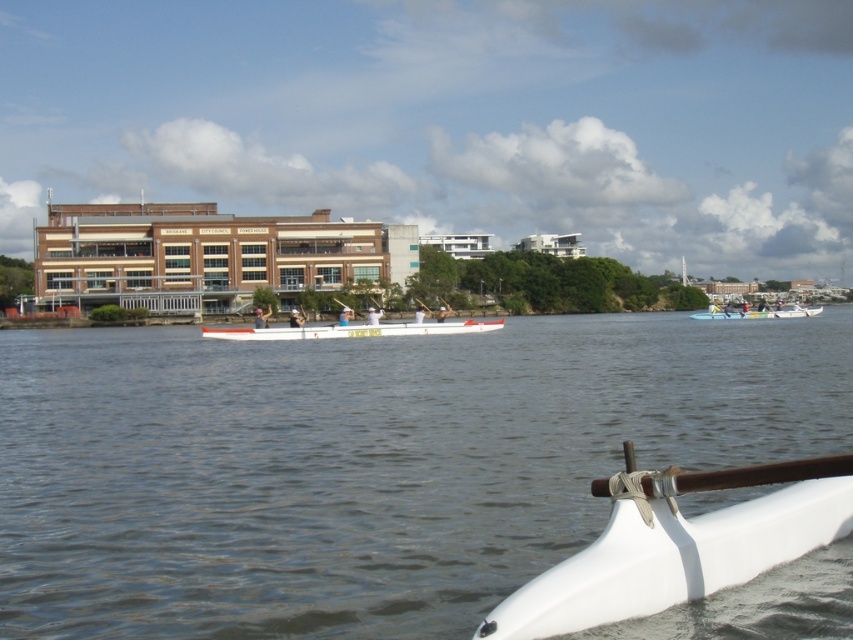
Question: Does white matte boat at lower right lie behind white glossy canoe at center?

Choices:
 (A) no
 (B) yes

Answer: (A)

Question: Does white matte boat at lower right have a lesser width compared to white wood boat at center?

Choices:
 (A) yes
 (B) no

Answer: (A)

Question: Which point appears farthest from the camera in this image?

Choices:
 (A) (753, 308)
 (B) (86, 433)
 (C) (202, 337)

Answer: (A)

Question: Is white matte boat at lower right wider than white wood boat at center?

Choices:
 (A) no
 (B) yes

Answer: (A)

Question: Estimate the real-world distances between objects in this image. Which object is farther from the white wood boat at center?

Choices:
 (A) white smooth water at center
 (B) white glossy canoe at center
 (C) white matte boat at lower right

Answer: (B)

Question: Which point appears farthest from the camera in this image?

Choices:
 (A) (256, 528)
 (B) (795, 307)

Answer: (B)